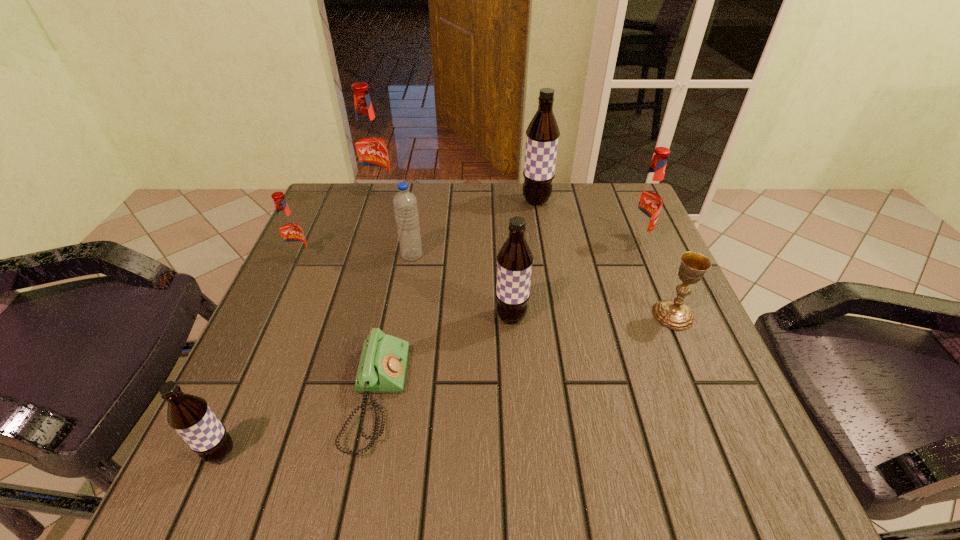
Identify the location of vacant space located on the right of the water bottle. (554, 255).

You are a GUI agent. You are given a task and a screenshot of the screen. Output one action in this format:
    pyautogui.click(x=<x>, y=<y>)
    Task: Click on the free space located 0.100m on the front of the nearest red root beer
    Image resolution: width=960 pixels, height=540 pixels.
    Given the screenshot: What is the action you would take?
    pyautogui.click(x=283, y=298)

The height and width of the screenshot is (540, 960). What are the coordinates of `free location located on the right of the nearest brown root beer` in the screenshot? It's located at (358, 453).

Where is `free space located on the back of the chalice`? The height and width of the screenshot is (540, 960). free space located on the back of the chalice is located at coordinates (643, 244).

The height and width of the screenshot is (540, 960). I want to click on free space located on the dial of the telephone, so click(x=468, y=396).

I want to click on root beer situated at the near edge, so click(x=190, y=416).

At what (x,y) coordinates should I click in order to perform the action: click on telephone that is at the near edge. Please return your answer as a coordinate pair (x, y). This screenshot has width=960, height=540. Looking at the image, I should click on (382, 367).

Where is `root beer situated at the right edge`? root beer situated at the right edge is located at coordinates (648, 198).

Find the location of `chalice located in the right edge section of the desktop`. chalice located in the right edge section of the desktop is located at coordinates (673, 313).

Find the location of a particular element. This screenshot has height=540, width=960. object at the far left corner is located at coordinates (370, 146).